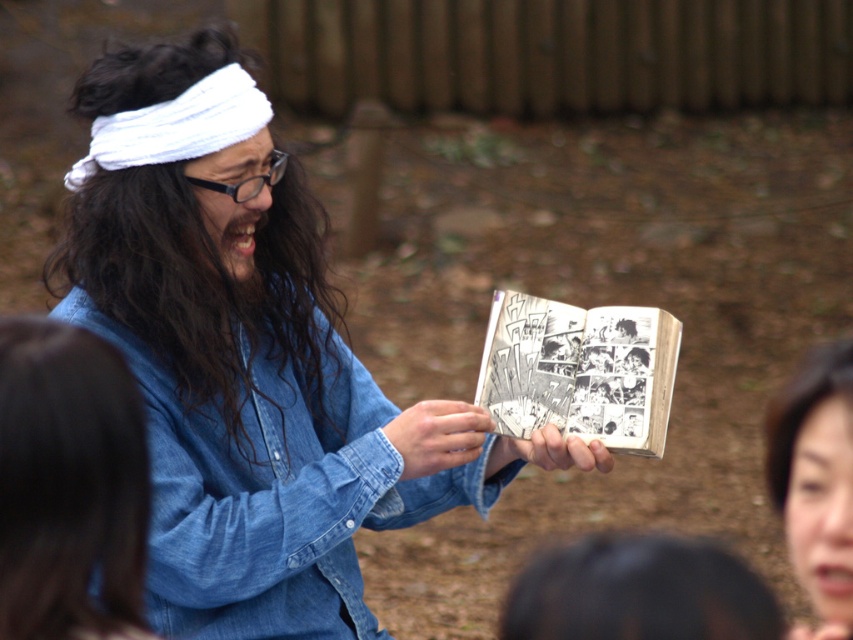
Based on the photo, you are a photographer trying to capture the scene. You notice two points in the image at coordinates point (154,333) and point (782,490). Which point is closer to the camera?

Point (154,333) is further to the camera than point (782,490), so the point closer to the camera is point (782,490).

You are a photographer trying to capture a portrait of the person holding the comic book. The denim jacket at center and smooth brown hair at lower right are both in the frame. Which object should you focus on if you want to highlight the taller one?

The denim jacket at center is taller than the smooth brown hair at lower right, so you should focus on the denim jacket at center to highlight the taller object.